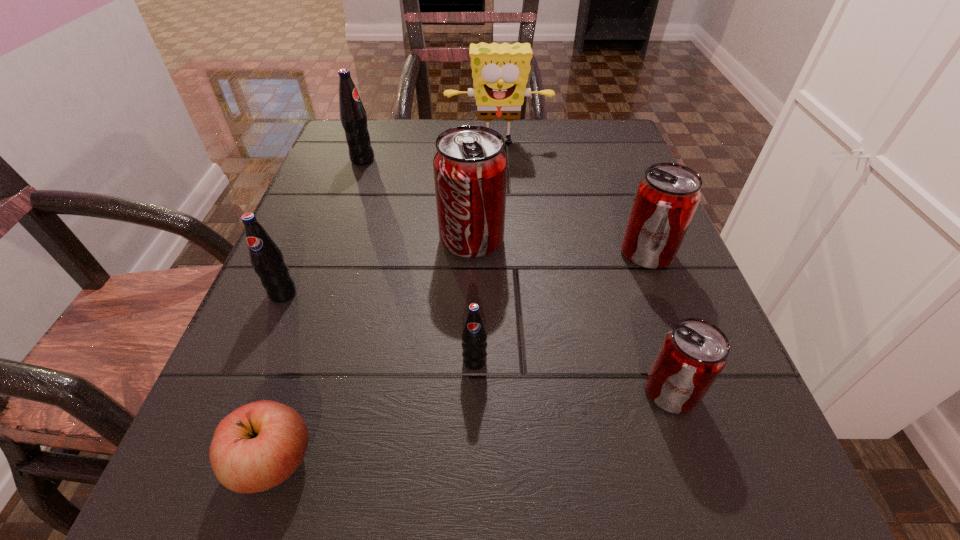
Identify the location of free space at the far left corner. pyautogui.click(x=388, y=140).

Locate an element on the screen. Image resolution: width=960 pixels, height=540 pixels. vacant region at the far right corner is located at coordinates (583, 148).

Where is `vacant space at the near right corner of the desktop`? The image size is (960, 540). vacant space at the near right corner of the desktop is located at coordinates (742, 490).

Locate an element on the screen. free point between the rightmost black pop and the smallest red pop soda is located at coordinates (572, 376).

What are the coordinates of `empty space between the leftmost pop and the farthest pop` in the screenshot? It's located at (323, 227).

Where is `free space between the nearest object and the farthest pop`? The height and width of the screenshot is (540, 960). free space between the nearest object and the farthest pop is located at coordinates (319, 310).

Where is `empty space that is in between the red apple and the farthest pop`? This screenshot has width=960, height=540. empty space that is in between the red apple and the farthest pop is located at coordinates (319, 310).

The width and height of the screenshot is (960, 540). In order to click on free space between the biggest red pop soda and the rightmost black pop in this screenshot , I will do point(473,300).

Find the location of a particular element. vacant space in between the sponge and the red apple is located at coordinates (386, 302).

This screenshot has height=540, width=960. I want to click on vacant space that's between the leftmost pop and the second biggest red pop soda, so click(x=465, y=274).